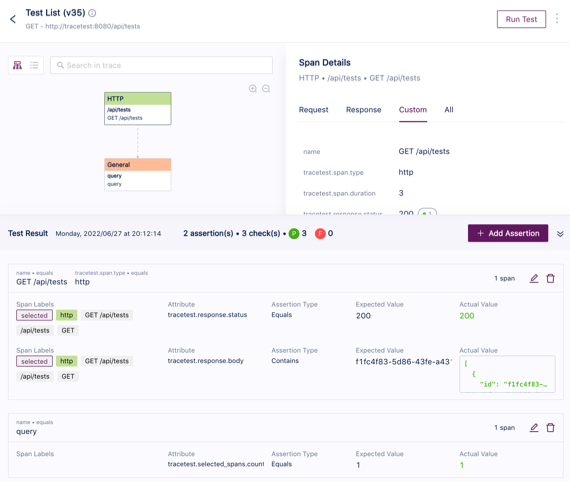
Locate an element on the screen. This screenshot has width=570, height=482. trash can is located at coordinates (549, 279), (549, 429).